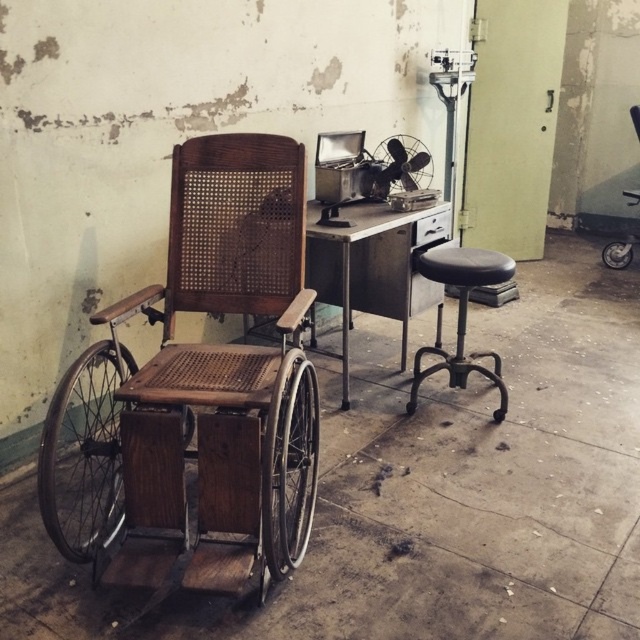
Can you confirm if metallic/textured desk at center is taller than black leather swivel chair at right?

Indeed, metallic/textured desk at center has a greater height compared to black leather swivel chair at right.

Which is behind, point (374, 275) or point (637, 115)?

The point (637, 115) is more distant.

Between point (342, 408) and point (632, 188), which one is positioned in front?

Point (342, 408) is more forward.

You are a GUI agent. You are given a task and a screenshot of the screen. Output one action in this format:
    pyautogui.click(x=<x>, y=<y>)
    Task: Click on the metallic/textured desk at center
    
    Given the screenshot: What is the action you would take?
    pyautogui.click(x=371, y=268)

Describe the element at coordinates (371, 268) in the screenshot. I see `metallic/textured desk at center` at that location.

Is metallic/textured desk at center bigger than metallic silver fan at center?

Yes, metallic/textured desk at center is bigger than metallic silver fan at center.

Does point (436, 301) lie behind point (396, 161)?

Yes.

The image size is (640, 640). Find the location of `metallic/textured desk at center`. metallic/textured desk at center is located at coordinates (371, 268).

Does wooden cane wheelchair at left appear over metallic silver fan at center?

Incorrect, wooden cane wheelchair at left is not positioned above metallic silver fan at center.

Does wooden cane wheelchair at left have a lesser height compared to metallic silver fan at center?

No, wooden cane wheelchair at left is not shorter than metallic silver fan at center.

Who is more forward, (218, 440) or (392, 168)?

Point (218, 440) is in front.

What are the coordinates of `wooden cane wheelchair at left` in the screenshot? It's located at click(x=208, y=385).